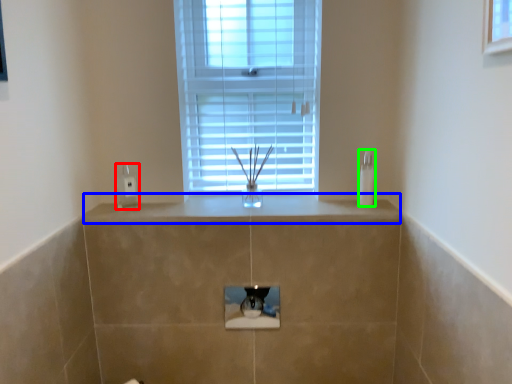
Question: Considering the real-world distances, which object is closest to electric outlet (highlighted by a red box)? counter top (highlighted by a blue box) or soap dispenser (highlighted by a green box).

Choices:
 (A) counter top
 (B) soap dispenser

Answer: (A)